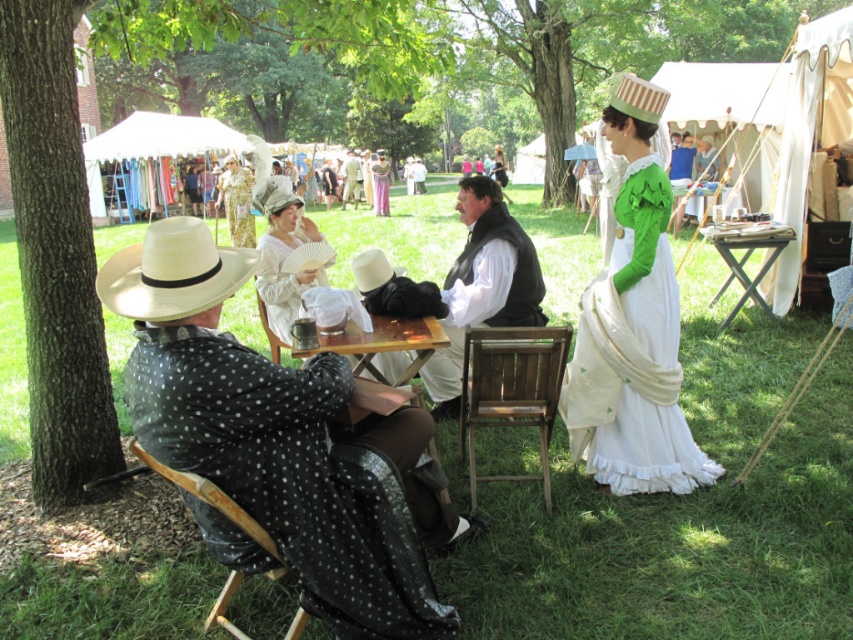
Question: Estimate the real-world distances between objects in this image. Which object is closer to the wooden table at right?

Choices:
 (A) brown rough bark tree at left
 (B) floral fabric dress at center
 (C) black dotted fabric at left

Answer: (C)

Question: Which object is the farthest from the white lace dress at center?

Choices:
 (A) floral fabric dress at center
 (B) light beige fabric hat at center
 (C) blue fabric at center
 (D) white cotton vest at center

Answer: (B)

Question: From the image, what is the correct spatial relationship of blue fabric at center in relation to light beige fabric hat at center?

Choices:
 (A) left
 (B) right

Answer: (B)

Question: Is floral fabric dress at center closer to the viewer compared to silk white dress at center?

Choices:
 (A) no
 (B) yes

Answer: (B)

Question: Is green leafy tree at left bigger than white cotton dress at center?

Choices:
 (A) yes
 (B) no

Answer: (A)

Question: Which of the following is the farthest from the observer?

Choices:
 (A) silk white dress at center
 (B) green leafy tree at left
 (C) wooden table at right
 (D) blue fabric at center

Answer: (A)